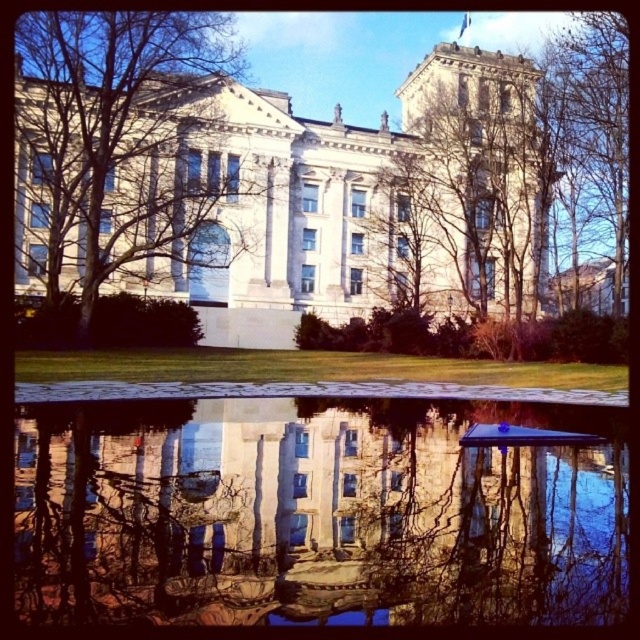
You are standing in front of the grand neoclassical building with the two points marked on the lawn. The first point is at coordinate (465, 476) and the second point is at (586, 161). Which point is closer to the building?

Result: Point (465, 476) is in front of point (586, 161), so it is closer to the building.

You are a photographer planning to capture the grand building while ensuring the transparent glass water at center and the bare branches at upper center are both visible in the frame. Based on their positions, which object should you focus on first to ensure both are in focus?

You should focus on the bare branches at upper center first because the transparent glass water at center is in front of it, so focusing on the farther object ensures both are in focus.